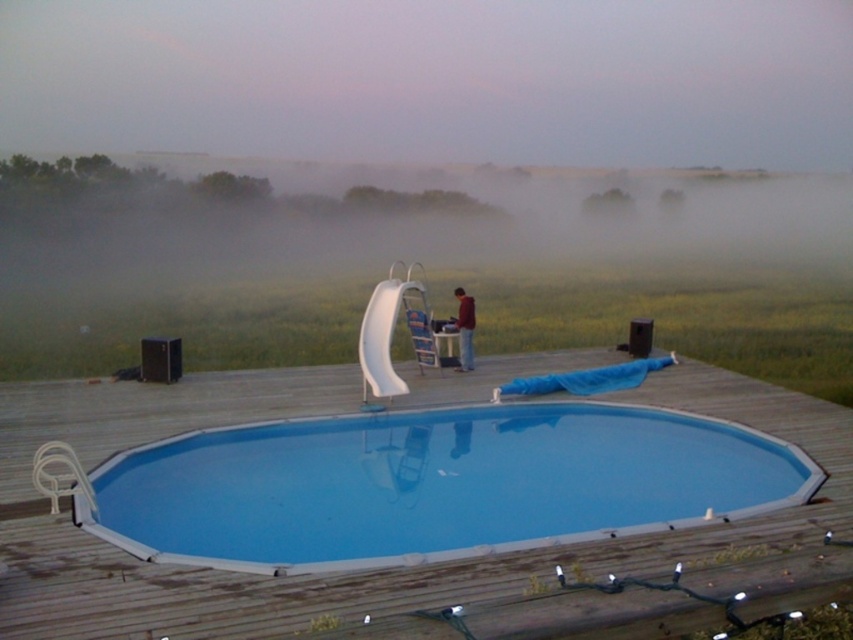
Question: Can you confirm if blue metallic pool at center is positioned to the right of white plastic chair at center?

Choices:
 (A) yes
 (B) no

Answer: (A)

Question: Which of the following is the closest to the observer?

Choices:
 (A) blue metallic pool at center
 (B) maroon sweater at center
 (C) white plastic chair at center

Answer: (A)

Question: Considering the relative positions of blue metallic pool at center and maroon sweater at center in the image provided, where is blue metallic pool at center located with respect to maroon sweater at center?

Choices:
 (A) below
 (B) above

Answer: (A)

Question: Which object appears farthest from the camera in this image?

Choices:
 (A) white plastic chair at center
 (B) maroon sweater at center
 (C) blue metallic pool at center

Answer: (B)

Question: Is blue metallic pool at center positioned before white plastic chair at center?

Choices:
 (A) yes
 (B) no

Answer: (A)

Question: Estimate the real-world distances between objects in this image. Which object is farther from the maroon sweater at center?

Choices:
 (A) blue metallic pool at center
 (B) white plastic chair at center

Answer: (A)